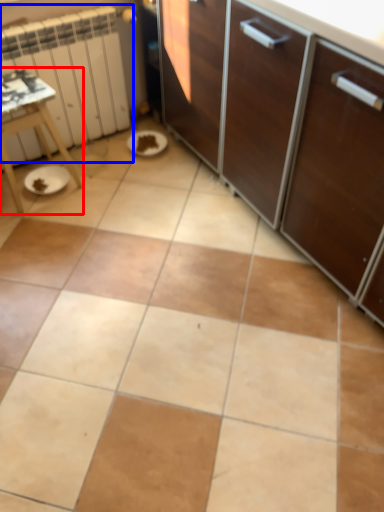
Question: Among these objects, which one is nearest to the camera, table (highlighted by a red box) or radiator (highlighted by a blue box)?

Choices:
 (A) table
 (B) radiator

Answer: (A)